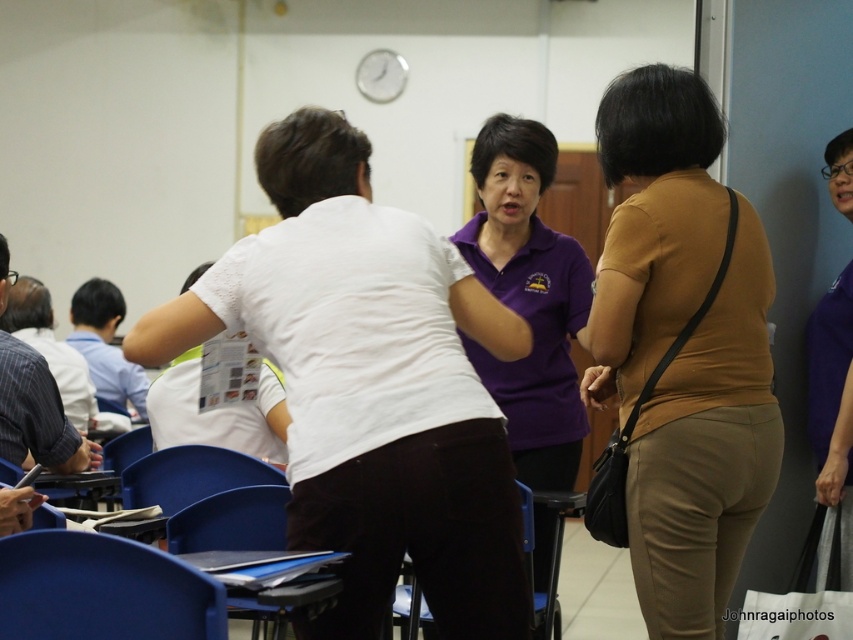
Question: Which object is the farthest from the purple matte shirt at center?

Choices:
 (A) blue plastic chair at lower left
 (B) white fabric shopping bag at lower right
 (C) matte brown blouse at center
 (D) blue plastic chair at lower center

Answer: (A)

Question: Among these points, which one is nearest to the camera?

Choices:
 (A) (138, 568)
 (B) (833, 580)
 (C) (482, 280)
 (D) (181, 534)

Answer: (A)

Question: Can you confirm if matte brown blouse at center is smaller than blue plastic chair at lower left?

Choices:
 (A) no
 (B) yes

Answer: (A)

Question: Which point is closer to the camera?

Choices:
 (A) (6, 554)
 (B) (552, 280)
 (C) (321, 600)

Answer: (A)

Question: Does matte brown blouse at center appear under purple matte shirt at center?

Choices:
 (A) no
 (B) yes

Answer: (B)

Question: Is matte brown blouse at center above white fabric shopping bag at lower right?

Choices:
 (A) no
 (B) yes

Answer: (B)